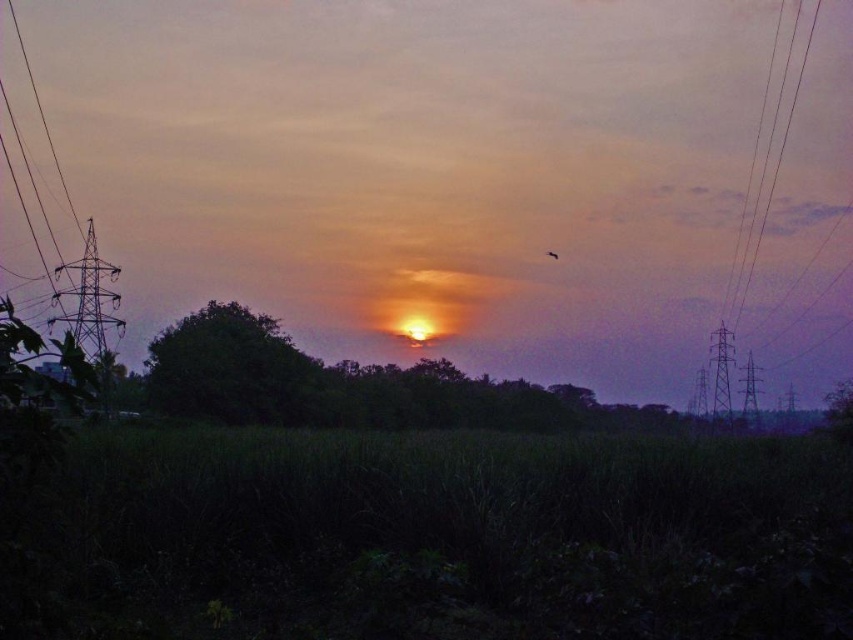
Question: In this image, where is green leafy tree at center located relative to orange matte bird at center?

Choices:
 (A) left
 (B) right

Answer: (A)

Question: Does green leafy tree at center have a greater width compared to orange matte bird at center?

Choices:
 (A) yes
 (B) no

Answer: (A)

Question: Considering the real-world distances, which object is farthest from the orange matte bird at center?

Choices:
 (A) green leafy tree at center
 (B) metallic wire at right

Answer: (A)

Question: Among these points, which one is farthest from the camera?

Choices:
 (A) (749, 275)
 (B) (555, 252)
 (C) (173, 364)

Answer: (A)

Question: Does green leafy tree at center have a larger size compared to orange matte bird at center?

Choices:
 (A) yes
 (B) no

Answer: (A)

Question: Which object is farther from the camera taking this photo?

Choices:
 (A) orange matte bird at center
 (B) green leafy tree at center
 (C) metallic wire at right

Answer: (A)